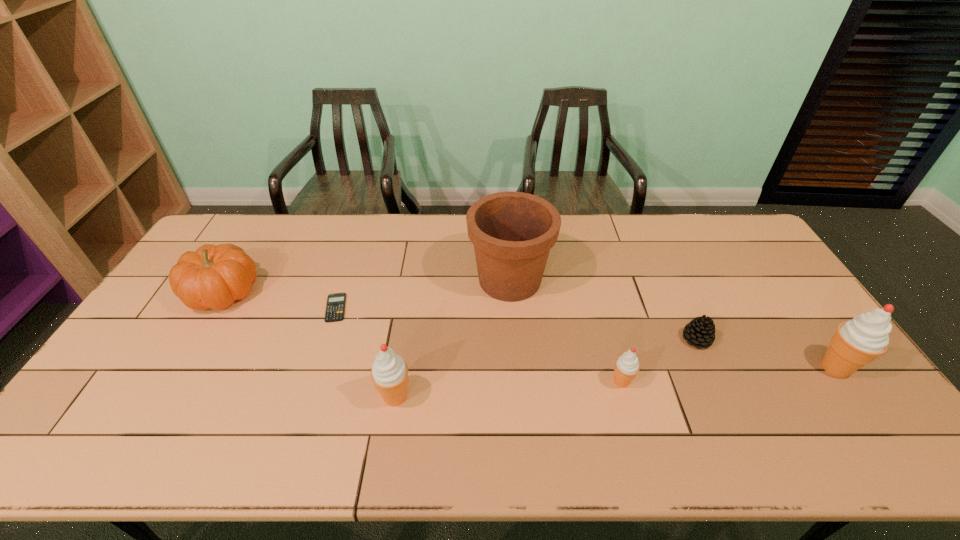
Where is `the closest object to the calculator`? The width and height of the screenshot is (960, 540). the closest object to the calculator is located at coordinates (214, 276).

Find the location of a particular element. The height and width of the screenshot is (540, 960). the fourth closest object relative to the second shortest icecream is located at coordinates (627, 366).

Select which icecream appears as the closest to the flowerpot. Please provide its 2D coordinates. Your answer should be formatted as a tuple, i.e. [(x, y)], where the tuple contains the x and y coordinates of a point satisfying the conditions above.

[(627, 366)]

Image resolution: width=960 pixels, height=540 pixels. I want to click on icecream that is the second closest to the leftmost icecream, so click(857, 342).

Find the location of a particular element. vacant region that satisfies the following two spatial constraints: 1. on the back side of the rightmost object; 2. on the right side of the third tallest object is located at coordinates (399, 368).